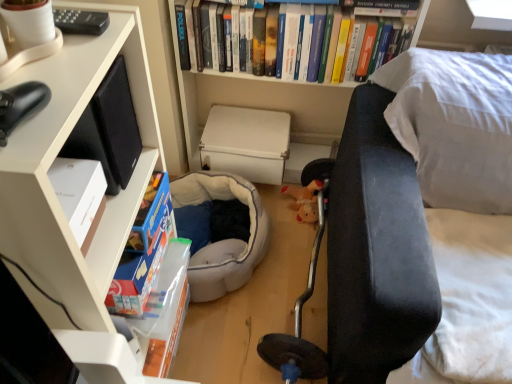
What do you see at coordinates (408, 198) in the screenshot?
I see `velvet dark blue couch at right` at bounding box center [408, 198].

Where is `white matte bookcase at left, which appears as the 1th bookcase when viewed from the front`? Image resolution: width=512 pixels, height=384 pixels. white matte bookcase at left, which appears as the 1th bookcase when viewed from the front is located at coordinates tap(59, 204).

Describe the element at coordinates (59, 204) in the screenshot. I see `white matte bookcase at left, which appears as the 1th bookcase when viewed from the front` at that location.

Where is `velvet dark blue couch at right`? The image size is (512, 384). velvet dark blue couch at right is located at coordinates 408,198.

From a real-world perspective, which bookcase is the 2nd one above the white matte box at center? Please provide its 2D coordinates.

[(59, 204)]

Does point (99, 229) appear closer or farther from the camera than point (258, 152)?

Point (99, 229) appears to be closer to the viewer than point (258, 152).

Considering the sizes of objects white matte bookcase at left, placed as the second bookcase when sorted from back to front, and white matte box at center in the image provided, who is thinner, white matte bookcase at left, placed as the second bookcase when sorted from back to front, or white matte box at center?

With smaller width is white matte box at center.

Considering the sizes of white matte bookcase at left, which appears as the 1th bookcase when viewed from the front, and white matte box at center in the image, is white matte bookcase at left, which appears as the 1th bookcase when viewed from the front, bigger or smaller than white matte box at center?

white matte bookcase at left, which appears as the 1th bookcase when viewed from the front, is bigger than white matte box at center.

I want to click on book on the left of the white matte bookcase at upper center, acting as the 2th bookcase starting from the left, so click(197, 40).

Considering their positions, is hardcover books at upper center located in front of or behind white matte bookcase at upper center, the 1th bookcase viewed from the right?

Visually, hardcover books at upper center is located behind white matte bookcase at upper center, the 1th bookcase viewed from the right.

From the image's perspective, which object appears higher, hardcover books at upper center or white matte bookcase at upper center, the 1th bookcase viewed from the right?

hardcover books at upper center appears higher in the image.

Is white matte bookcase at left, which appears as the 1th bookcase when viewed from the front, oriented towards soft gray fabric bean bag at center?

No, white matte bookcase at left, which appears as the 1th bookcase when viewed from the front, is not aimed at soft gray fabric bean bag at center.

Which is more to the left, white matte bookcase at left, the 2th bookcase viewed from the right, or soft gray fabric bean bag at center?

From the viewer's perspective, white matte bookcase at left, the 2th bookcase viewed from the right, appears more on the left side.

Considering the relative sizes of white matte bookcase at left, the 2th bookcase viewed from the right, and soft gray fabric bean bag at center in the image provided, is white matte bookcase at left, the 2th bookcase viewed from the right, bigger than soft gray fabric bean bag at center?

Yes, white matte bookcase at left, the 2th bookcase viewed from the right, is bigger than soft gray fabric bean bag at center.

Which is in front, point (41, 130) or point (207, 199)?

Point (41, 130)

From a real-world perspective, who is located higher, white matte box at center or hardcover books at upper center?

hardcover books at upper center is physically above.

Can you confirm if white matte box at center is positioned to the left of hardcover books at upper center?

Indeed, white matte box at center is positioned on the left side of hardcover books at upper center.

In the scene shown: Is white matte box at center oriented towards hardcover books at upper center?

No, white matte box at center is not oriented towards hardcover books at upper center.

Considering the relative sizes of white matte bookcase at left, the first bookcase when ordered from left to right, and white matte bookcase at upper center, acting as the 2th bookcase starting from the left, in the image provided, is white matte bookcase at left, the first bookcase when ordered from left to right, thinner than white matte bookcase at upper center, acting as the 2th bookcase starting from the left,?

Incorrect, the width of white matte bookcase at left, the first bookcase when ordered from left to right, is not less than that of white matte bookcase at upper center, acting as the 2th bookcase starting from the left.

Can you tell me how much white matte bookcase at left, which appears as the 1th bookcase when viewed from the front, and white matte bookcase at upper center, the first bookcase in the back-to-front sequence, differ in facing direction?

92.9 degrees.

Is white matte bookcase at left, the 2th bookcase viewed from the right, facing away from white matte bookcase at upper center, acting as the 2th bookcase starting from the left?

No, white matte bookcase at left, the 2th bookcase viewed from the right, is not facing away from white matte bookcase at upper center, acting as the 2th bookcase starting from the left.

Considering the relative sizes of white matte bookcase at left, which appears as the 1th bookcase when viewed from the front, and white matte bookcase at upper center, acting as the 2th bookcase starting from the left, in the image provided, is white matte bookcase at left, which appears as the 1th bookcase when viewed from the front, taller than white matte bookcase at upper center, acting as the 2th bookcase starting from the left,?

Indeed, white matte bookcase at left, which appears as the 1th bookcase when viewed from the front, has a greater height compared to white matte bookcase at upper center, acting as the 2th bookcase starting from the left.

Is soft gray fabric bean bag at center not within hardcover books at upper center?

Indeed, soft gray fabric bean bag at center is completely outside hardcover books at upper center.

Considering the relative sizes of soft gray fabric bean bag at center and hardcover books at upper center in the image provided, is soft gray fabric bean bag at center shorter than hardcover books at upper center?

Indeed, soft gray fabric bean bag at center has a lesser height compared to hardcover books at upper center.

From a real-world perspective, is soft gray fabric bean bag at center above or below hardcover books at upper center?

soft gray fabric bean bag at center is situated lower than hardcover books at upper center in the real world.

Is white matte box at center positioned with its back to white matte bookcase at left, placed as the second bookcase when sorted from back to front?

No.

Can you tell me how much white matte box at center and white matte bookcase at left, the first bookcase when ordered from left to right, differ in facing direction?

The angular difference between white matte box at center and white matte bookcase at left, the first bookcase when ordered from left to right, is 93.8 degrees.

Looking at the image, does white matte box at center seem bigger or smaller compared to white matte bookcase at left, the first bookcase when ordered from left to right?

white matte box at center is smaller than white matte bookcase at left, the first bookcase when ordered from left to right.

From the image's perspective, which is below, white matte box at center or white matte bookcase at left, which appears as the 1th bookcase when viewed from the front?

white matte bookcase at left, which appears as the 1th bookcase when viewed from the front.

Where is `paperback book behind the white matte bookcase at left, which appears as the 1th bookcase when viewed from the front`? The width and height of the screenshot is (512, 384). paperback book behind the white matte bookcase at left, which appears as the 1th bookcase when viewed from the front is located at coordinates (246, 143).

Image resolution: width=512 pixels, height=384 pixels. Identify the location of the 1st bookcase in front of the hardcover books at upper center, counting from the anchor's position. (259, 101).

Considering their positions, is white matte box at center positioned closer to velvet dark blue couch at right than white matte bookcase at upper center, placed as the 2th bookcase when sorted from front to back?

Based on the image, white matte box at center appears to be nearer to velvet dark blue couch at right.

Based on their spatial positions, is white matte bookcase at left, the 2th bookcase viewed from the right, or hardcover books at upper center closer to velvet dark blue couch at right?

hardcover books at upper center lies closer to velvet dark blue couch at right than the other object.

Estimate the real-world distances between objects in this image. Which object is closer to white matte bookcase at upper center, the 1th bookcase viewed from the right, hardcover books at upper center or soft gray fabric bean bag at center?

Among the two, hardcover books at upper center is located nearer to white matte bookcase at upper center, the 1th bookcase viewed from the right.

From the image, which object appears to be farther from soft gray fabric bean bag at center, white matte bookcase at upper center, the first bookcase in the back-to-front sequence, or white matte bookcase at left, which appears as the 1th bookcase when viewed from the front?

white matte bookcase at left, which appears as the 1th bookcase when viewed from the front, is positioned further to the anchor soft gray fabric bean bag at center.

From the image, which object appears to be farther from velvet dark blue couch at right, hardcover books at upper center or soft gray fabric bean bag at center?

soft gray fabric bean bag at center lies further to velvet dark blue couch at right than the other object.

Which object lies nearer to the anchor point white matte bookcase at upper center, acting as the 2th bookcase starting from the left, white matte bookcase at left, the 2th bookcase viewed from the right, or velvet dark blue couch at right?

velvet dark blue couch at right.

When comparing their distances from white matte box at center, does white matte bookcase at upper center, the 1th bookcase viewed from the right, or velvet dark blue couch at right seem closer?

The object closer to white matte box at center is white matte bookcase at upper center, the 1th bookcase viewed from the right.

Estimate the real-world distances between objects in this image. Which object is closer to white matte box at center, hardcover books at upper center or soft gray fabric bean bag at center?

Based on the image, soft gray fabric bean bag at center appears to be nearer to white matte box at center.

In order to click on book positioned between velvet dark blue couch at right and white matte box at center from near to far in this screenshot , I will do `click(197, 40)`.

Where is `bookcase positioned between white matte bookcase at left, which appears as the 1th bookcase when viewed from the front, and soft gray fabric bean bag at center from near to far`? bookcase positioned between white matte bookcase at left, which appears as the 1th bookcase when viewed from the front, and soft gray fabric bean bag at center from near to far is located at coordinates (259, 101).

Where is `bean bag chair between white matte bookcase at left, which appears as the 1th bookcase when viewed from the front, and velvet dark blue couch at right from left to right`? Image resolution: width=512 pixels, height=384 pixels. bean bag chair between white matte bookcase at left, which appears as the 1th bookcase when viewed from the front, and velvet dark blue couch at right from left to right is located at coordinates (223, 240).

Where is `book positioned between white matte bookcase at left, the 2th bookcase viewed from the right, and white matte box at center from near to far`? The width and height of the screenshot is (512, 384). book positioned between white matte bookcase at left, the 2th bookcase viewed from the right, and white matte box at center from near to far is located at coordinates (197, 40).